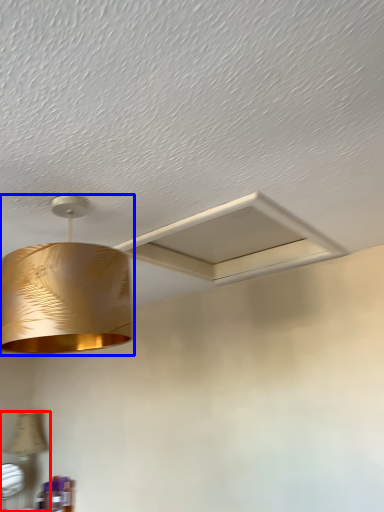
Question: Which object is closer to the camera taking this photo, lamp (highlighted by a red box) or lamp (highlighted by a blue box)?

Choices:
 (A) lamp
 (B) lamp

Answer: (B)